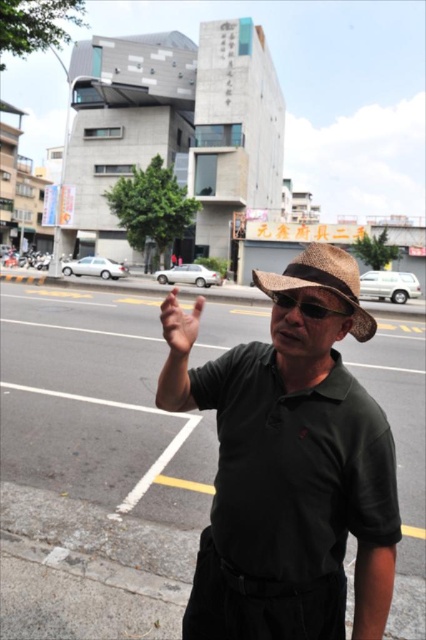
Question: Does dark green polo shirt at center appear on the right side of woven straw hat at center?

Choices:
 (A) yes
 (B) no

Answer: (B)

Question: Which of the following is the closest to the observer?

Choices:
 (A) (359, 611)
 (B) (172, 348)
 (C) (310, 260)
 (D) (302, 307)

Answer: (D)

Question: Does woven straw hat at center appear on the left side of matte brown hand at center?

Choices:
 (A) no
 (B) yes

Answer: (A)

Question: Estimate the real-world distances between objects in this image. Which object is closer to the dark green polo shirt at center?

Choices:
 (A) black plastic goggles at center
 (B) woven straw hat at center
 (C) matte brown hand at center

Answer: (A)

Question: Does dark green polo shirt at center appear on the right side of black plastic goggles at center?

Choices:
 (A) no
 (B) yes

Answer: (A)

Question: Among these points, which one is nearest to the camera?

Choices:
 (A) (339, 273)
 (B) (195, 321)

Answer: (A)